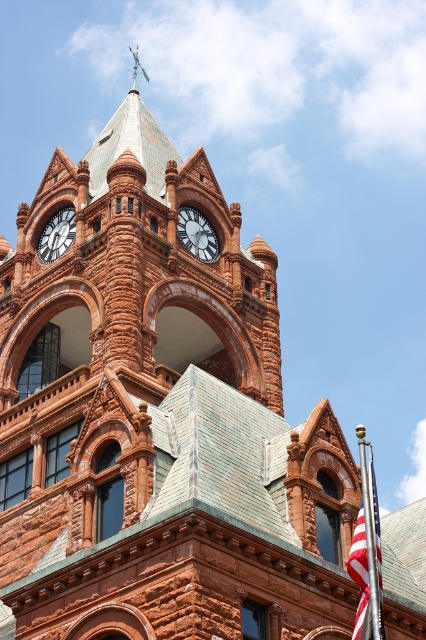
Question: Is american flag at lower right below matte black clock at center?

Choices:
 (A) yes
 (B) no

Answer: (A)

Question: Which is farther from the matte brown clock at upper left?

Choices:
 (A) american flag at lower right
 (B) matte black clock at center

Answer: (A)

Question: Which object is farther from the camera taking this photo?

Choices:
 (A) american flag at lower right
 (B) matte brown clock at upper left
 (C) matte black clock at center

Answer: (B)

Question: Estimate the real-world distances between objects in this image. Which object is closer to the american flag at lower right?

Choices:
 (A) matte black clock at center
 (B) matte brown clock at upper left

Answer: (A)

Question: Observing the image, what is the correct spatial positioning of american flag at lower right in reference to matte brown clock at upper left?

Choices:
 (A) right
 (B) left

Answer: (A)

Question: Does american flag at lower right appear on the right side of matte black clock at center?

Choices:
 (A) yes
 (B) no

Answer: (A)